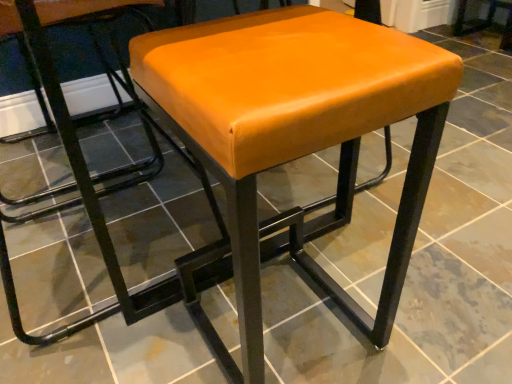
Find the location of `free space to the right of orange leather stool at center`. free space to the right of orange leather stool at center is located at coordinates (420, 307).